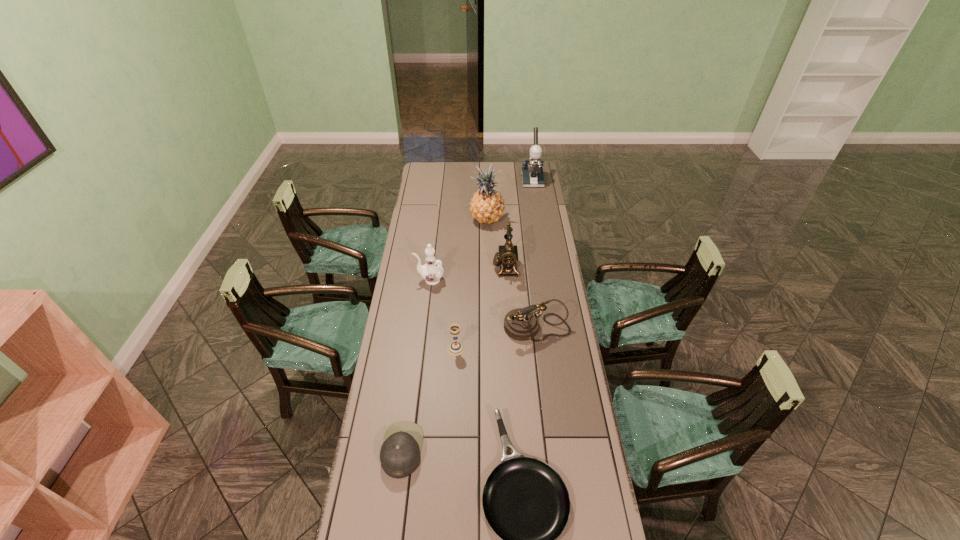
Locate an element on the screen. The height and width of the screenshot is (540, 960). cap located at the left edge is located at coordinates (400, 453).

Locate an element on the screen. The height and width of the screenshot is (540, 960). microscope situated at the right edge is located at coordinates (532, 175).

Locate an element on the screen. telephone at the right edge is located at coordinates (521, 324).

Locate an element on the screen. object positioned at the far right corner is located at coordinates (532, 175).

Image resolution: width=960 pixels, height=540 pixels. I want to click on free spot at the far edge of the desktop, so click(459, 173).

The width and height of the screenshot is (960, 540). I want to click on vacant space at the left edge, so click(x=434, y=228).

At what (x,y) coordinates should I click in order to perform the action: click on vacant space at the right edge of the desktop. Please return your answer as a coordinate pair (x, y). Looking at the image, I should click on (540, 278).

Locate an element on the screen. This screenshot has height=540, width=960. free space at the far left corner is located at coordinates 429,177.

Where is `unoccupied position between the farthest object and the pineapple`? unoccupied position between the farthest object and the pineapple is located at coordinates (510, 200).

The width and height of the screenshot is (960, 540). Identify the location of free point between the cap and the shorter telephone. (469, 389).